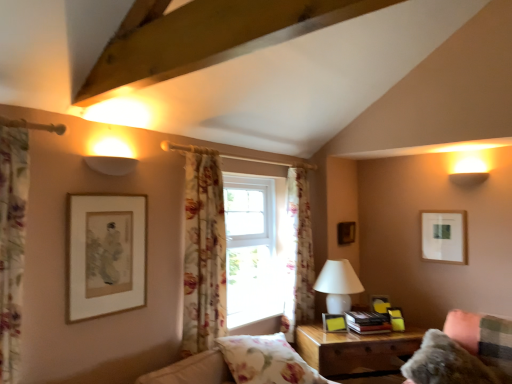
Where is `vacant space situated on the left part of matte yellow picture frame at right, the fifth picture frame viewed from the back`? The height and width of the screenshot is (384, 512). vacant space situated on the left part of matte yellow picture frame at right, the fifth picture frame viewed from the back is located at coordinates (315, 330).